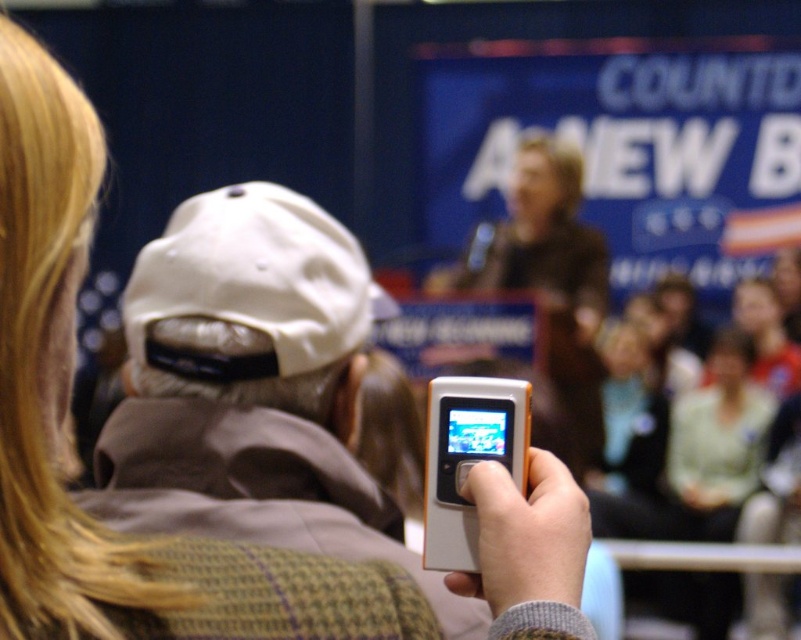
Question: Can you confirm if matte white cap at upper center is positioned above white matte phone at center?

Choices:
 (A) yes
 (B) no

Answer: (A)

Question: Which point is farther to the camera?

Choices:
 (A) pyautogui.click(x=513, y=401)
 (B) pyautogui.click(x=270, y=372)
 (C) pyautogui.click(x=308, y=198)
 (D) pyautogui.click(x=176, y=470)

Answer: (C)

Question: Can you confirm if white matte phone at center is positioned above silver metallic phone at center?

Choices:
 (A) yes
 (B) no

Answer: (B)

Question: Which object appears farthest from the camera in this image?

Choices:
 (A) white fabric baseball cap at center
 (B) silver metallic phone at center
 (C) white matte phone at center
 (D) white fabric cap at upper left

Answer: (A)

Question: Considering the relative positions of matte white cap at upper center and white matte phone at center in the image provided, where is matte white cap at upper center located with respect to white matte phone at center?

Choices:
 (A) right
 (B) left

Answer: (B)

Question: Considering the real-world distances, which object is farthest from the white fabric cap at upper left?

Choices:
 (A) silver metallic phone at center
 (B) matte white cap at upper center
 (C) white fabric baseball cap at center

Answer: (A)